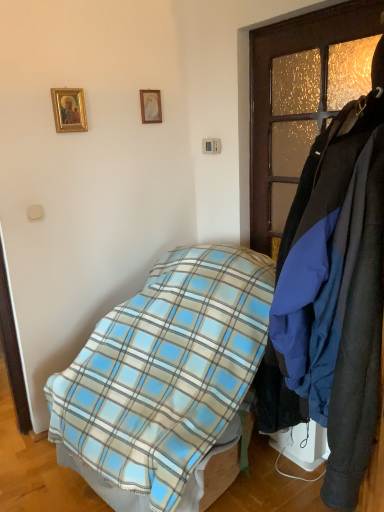
Question: From the image's perspective, is dark wood coat rack at right below gold-framed picture at upper left, which is the 2th picture frame from back to front?

Choices:
 (A) no
 (B) yes

Answer: (B)

Question: Is dark wood coat rack at right aimed at gold-framed picture at upper left, which is the 2th picture frame from back to front?

Choices:
 (A) no
 (B) yes

Answer: (A)

Question: Is the position of dark wood coat rack at right less distant than that of gold-framed picture at upper left, which is the 2th picture frame from back to front?

Choices:
 (A) no
 (B) yes

Answer: (B)

Question: Considering the relative positions of dark wood coat rack at right and gold-framed picture at upper left, marked as the 2th picture frame in a right-to-left arrangement, in the image provided, is dark wood coat rack at right to the right of gold-framed picture at upper left, marked as the 2th picture frame in a right-to-left arrangement, from the viewer's perspective?

Choices:
 (A) yes
 (B) no

Answer: (A)

Question: Can you confirm if dark wood coat rack at right is thinner than gold-framed picture at upper left, marked as the 2th picture frame in a right-to-left arrangement?

Choices:
 (A) yes
 (B) no

Answer: (B)

Question: Considering the positions of dark wood coat rack at right and blue plaid blanket at center in the image, is dark wood coat rack at right wider or thinner than blue plaid blanket at center?

Choices:
 (A) thin
 (B) wide

Answer: (A)

Question: Visually, is dark wood coat rack at right positioned to the left or to the right of blue plaid blanket at center?

Choices:
 (A) right
 (B) left

Answer: (A)

Question: Considering the positions of dark wood coat rack at right and blue plaid blanket at center in the image, is dark wood coat rack at right taller or shorter than blue plaid blanket at center?

Choices:
 (A) tall
 (B) short

Answer: (A)

Question: In terms of size, does dark wood coat rack at right appear bigger or smaller than blue plaid blanket at center?

Choices:
 (A) small
 (B) big

Answer: (A)

Question: Is dark wood coat rack at right in front of or behind gold-framed picture at upper left, which is the 2th picture frame from back to front, in the image?

Choices:
 (A) front
 (B) behind

Answer: (A)

Question: Considering the positions of dark wood coat rack at right and gold-framed picture at upper left, the 1th picture frame in the front-to-back sequence, in the image, is dark wood coat rack at right wider or thinner than gold-framed picture at upper left, the 1th picture frame in the front-to-back sequence,?

Choices:
 (A) thin
 (B) wide

Answer: (B)

Question: Considering the positions of dark wood coat rack at right and gold-framed picture at upper left, marked as the 2th picture frame in a right-to-left arrangement, in the image, is dark wood coat rack at right bigger or smaller than gold-framed picture at upper left, marked as the 2th picture frame in a right-to-left arrangement,?

Choices:
 (A) big
 (B) small

Answer: (A)

Question: From a real-world perspective, is dark wood coat rack at right positioned above or below gold-framed picture at upper left, the 1th picture frame in the front-to-back sequence?

Choices:
 (A) above
 (B) below

Answer: (B)

Question: Based on their sizes in the image, would you say dark wood coat rack at right is bigger or smaller than wooden picture frame at upper center, the 2th picture frame viewed from the left?

Choices:
 (A) small
 (B) big

Answer: (B)

Question: From a real-world perspective, is dark wood coat rack at right physically located above or below wooden picture frame at upper center, the 2th picture frame viewed from the left?

Choices:
 (A) above
 (B) below

Answer: (B)